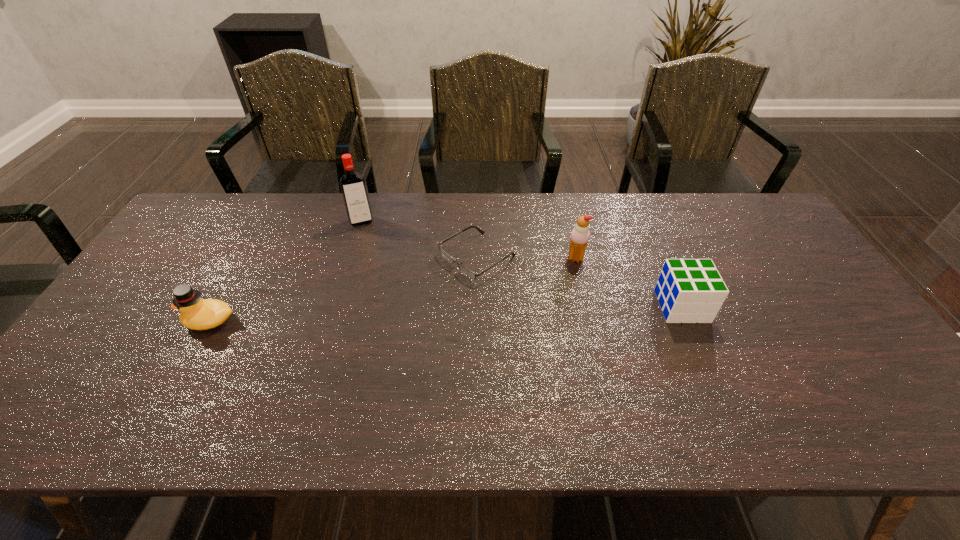
What are the coordinates of `free spot between the third object from right to left and the leftmost object` in the screenshot? It's located at (344, 289).

The image size is (960, 540). Find the location of `free space between the third object from right to left and the fourth object from right to left`. free space between the third object from right to left and the fourth object from right to left is located at coordinates (420, 239).

The image size is (960, 540). In order to click on free spot between the rightmost object and the leftmost object in this screenshot , I will do `click(446, 313)`.

Where is `unoccupied position between the farthest object and the cube`? This screenshot has width=960, height=540. unoccupied position between the farthest object and the cube is located at coordinates (521, 264).

Where is `free point between the fourth object from left to right and the shortest object`? The image size is (960, 540). free point between the fourth object from left to right and the shortest object is located at coordinates click(x=526, y=258).

You are a GUI agent. You are given a task and a screenshot of the screen. Output one action in this format:
    pyautogui.click(x=<x>, y=<y>)
    Task: Click on the unoccupied position between the second object from right to left and the duck
    
    Given the screenshot: What is the action you would take?
    pyautogui.click(x=394, y=289)

Locate an element on the screen. The height and width of the screenshot is (540, 960). free point between the vodka and the second object from right to left is located at coordinates (468, 240).

Locate an element on the screen. vacant point located between the shortest object and the second tallest object is located at coordinates (526, 258).

The width and height of the screenshot is (960, 540). Find the location of `blank region between the leftmost object and the shortest object`. blank region between the leftmost object and the shortest object is located at coordinates (344, 289).

Identify which object is the second nearest to the spectacles. Please provide its 2D coordinates. Your answer should be formatted as a tuple, i.e. [(x, y)], where the tuple contains the x and y coordinates of a point satisfying the conditions above.

[(352, 184)]